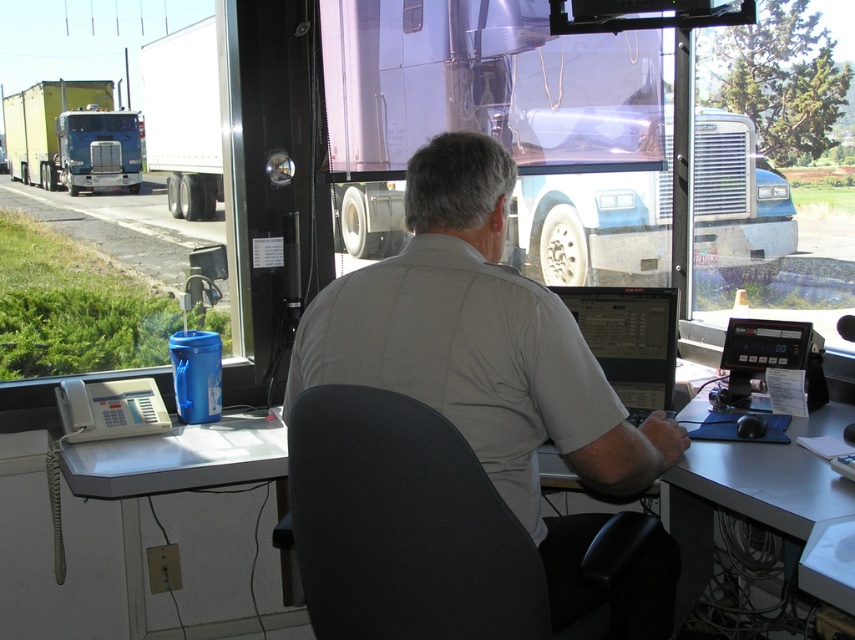
Can you confirm if white plastic desk at center is positioned below white plastic table at lower left?

Correct, white plastic desk at center is located below white plastic table at lower left.

Can you confirm if white plastic desk at center is taller than white plastic table at lower left?

Indeed, white plastic desk at center has a greater height compared to white plastic table at lower left.

The height and width of the screenshot is (640, 855). I want to click on white plastic desk at center, so (753, 490).

Does black fabric chair at center appear over white plastic table at lower left?

No.

Measure the distance between black fabric chair at center and white plastic table at lower left.

The distance of black fabric chair at center from white plastic table at lower left is 35.89 inches.

Between point (463, 552) and point (246, 433), which one is positioned behind?

The point (246, 433) is behind.

Where is `black fabric chair at center`? black fabric chair at center is located at coordinates (447, 536).

In the scene shown: Is gray plastic table at center to the right of yellow-green trailer truck at left from the viewer's perspective?

Yes, gray plastic table at center is to the right of yellow-green trailer truck at left.

This screenshot has height=640, width=855. What do you see at coordinates (750, 492) in the screenshot?
I see `gray plastic table at center` at bounding box center [750, 492].

At what (x,y) coordinates should I click in order to perform the action: click on gray plastic table at center. Please return your answer as a coordinate pair (x, y). The image size is (855, 640). Looking at the image, I should click on (750, 492).